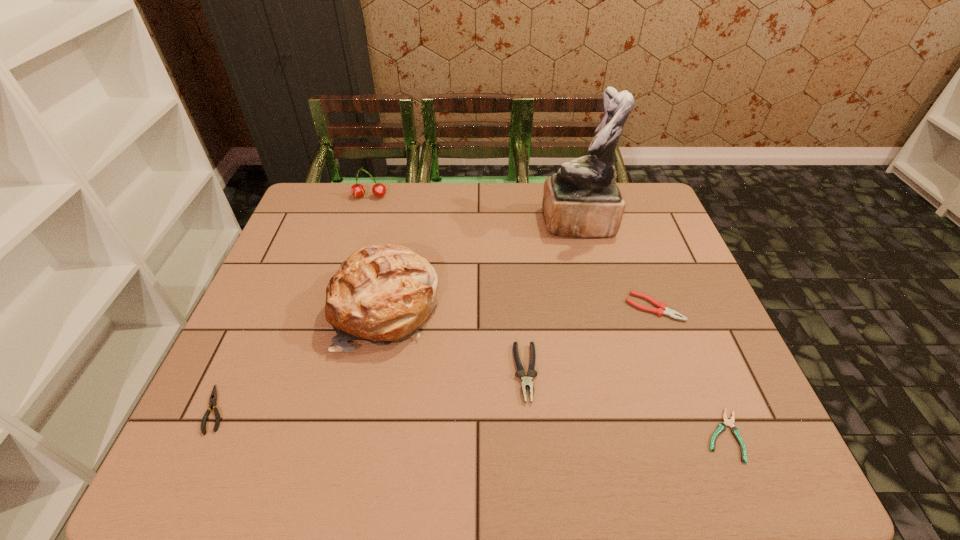
This screenshot has width=960, height=540. In order to click on the tallest object in this screenshot , I will do `click(582, 200)`.

The width and height of the screenshot is (960, 540). Identify the location of the second farthest object. (582, 200).

The height and width of the screenshot is (540, 960). Find the location of `bread`. bread is located at coordinates (382, 293).

Find the location of a particular element. The width and height of the screenshot is (960, 540). the farthest object is located at coordinates (357, 190).

Identify the location of the third tallest object. This screenshot has width=960, height=540. (357, 190).

Identify the location of the second pliers from left to right. (526, 382).

Where is `the fourth object from right to left`? This screenshot has height=540, width=960. the fourth object from right to left is located at coordinates (526, 382).

You are a GUI agent. You are given a task and a screenshot of the screen. Output one action in this format:
    pyautogui.click(x=<x>, y=<y>)
    Task: Click on the second tallest pliers
    Image resolution: width=960 pixels, height=540 pixels.
    Given the screenshot: What is the action you would take?
    pyautogui.click(x=659, y=311)

This screenshot has height=540, width=960. What are the coordinates of `the fifth tallest object` in the screenshot? It's located at (659, 311).

Find the location of a particular element. The image size is (960, 540). the leftmost object is located at coordinates (213, 397).